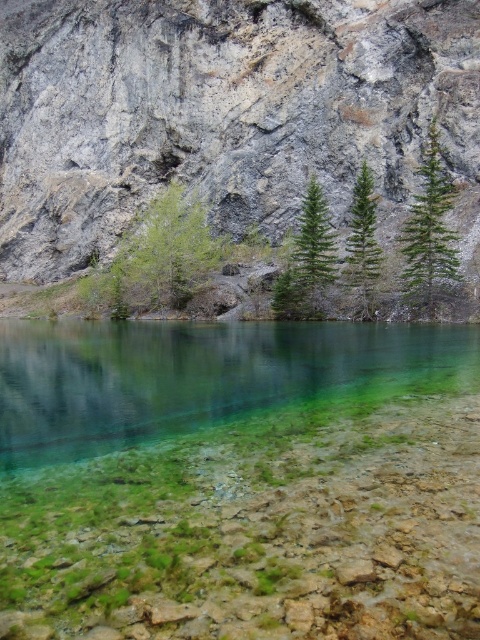
Can you confirm if green pine tree at upper right is positioned to the left of green needle-like tree at center?

No, green pine tree at upper right is not to the left of green needle-like tree at center.

Who is positioned more to the left, green pine tree at upper right or green needle-like tree at center?

Positioned to the left is green needle-like tree at center.

The image size is (480, 640). I want to click on green pine tree at upper right, so click(429, 230).

I want to click on green pine tree at upper right, so point(429,230).

Is point (47, 339) positioned after point (369, 173)?

That is False.

In the scene shown: Is clear glassy water at center shorter than green textured pine tree at center?

Indeed, clear glassy water at center has a lesser height compared to green textured pine tree at center.

Who is more distant from viewer, (431, 356) or (359, 264)?

The point (359, 264) is behind.

Find the location of a particular element. clear glassy water at center is located at coordinates (202, 376).

Is gray rock mountain at upper center above clear glassy water at center?

Yes.

Measure the distance between gray rock mountain at upper center and camera.

gray rock mountain at upper center is 312.65 feet away from camera.

Locate an element on the screen. gray rock mountain at upper center is located at coordinates (217, 112).